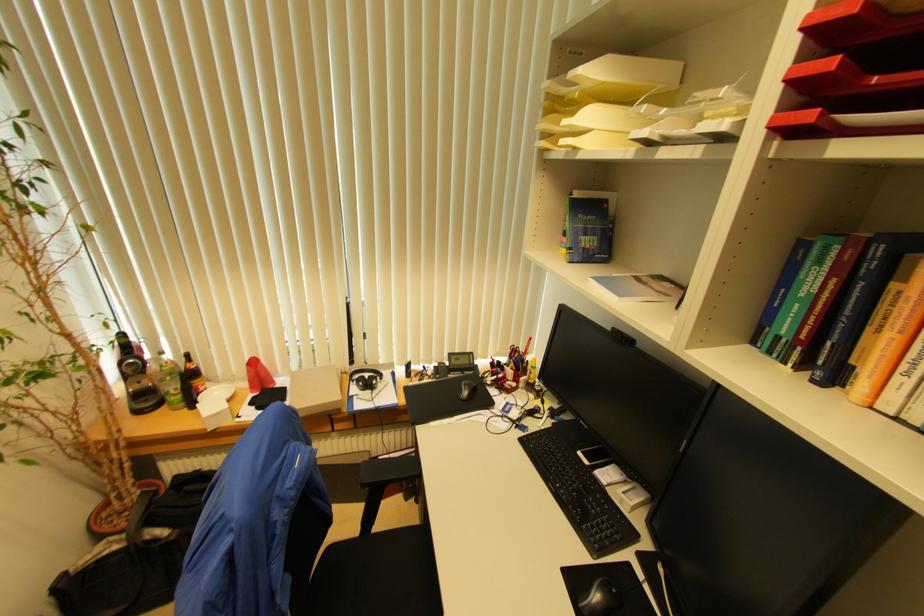
Locate an element on the screen. chair armest is located at coordinates (391, 468).